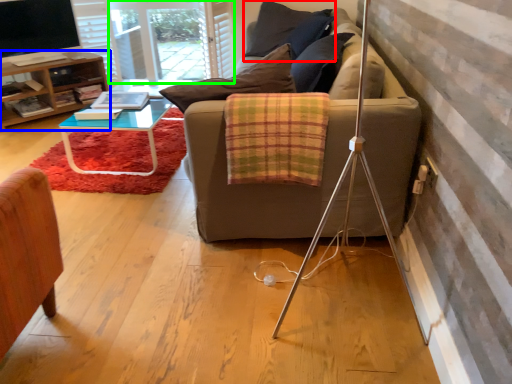
Question: Which is nearer to the pillow (highlighted by a red box)? table (highlighted by a blue box) or screen door (highlighted by a green box).

Choices:
 (A) table
 (B) screen door

Answer: (B)